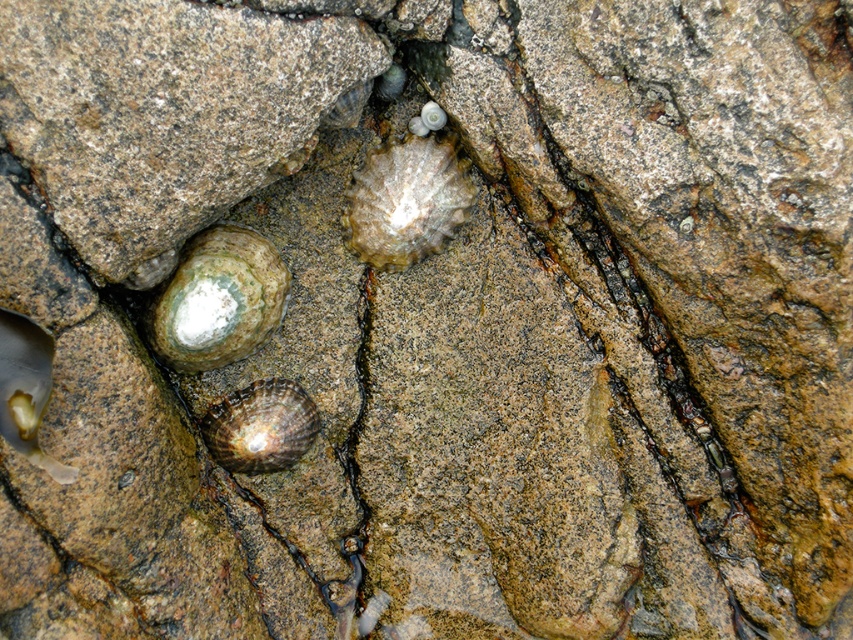
You are a geologist examining the rocky surface in the image. You notice a point at coordinates (219, 300). What is the color and position of the object at this point?

The point (219, 300) corresponds to the greenish brown stone at lower left.